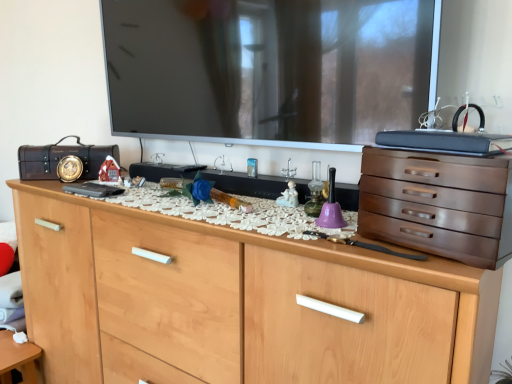
You are a GUI agent. You are given a task and a screenshot of the screen. Output one action in this format:
    pyautogui.click(x=<x>, y=<y>)
    Task: Click on the free spot above white matte table at lower left (from a real-world perspective)
    This screenshot has width=512, height=384.
    Given the screenshot: What is the action you would take?
    pyautogui.click(x=11, y=344)